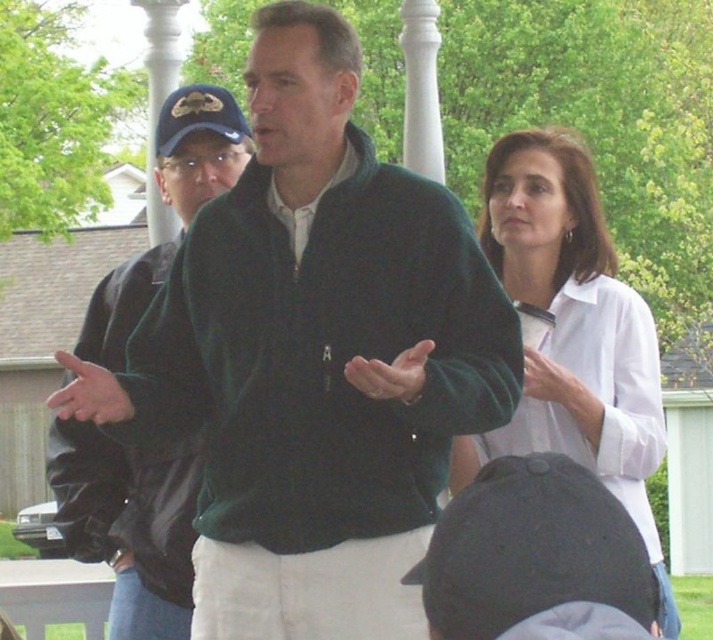
Who is taller, green fleece jacket at center or green matte jacket at left?

green fleece jacket at center is taller.

What are the coordinates of `green fleece jacket at center` in the screenshot? It's located at (314, 358).

Is point (312, 296) closer to camera compared to point (568, 221)?

Yes, it is in front of point (568, 221).

Is green fleece jacket at center to the right of white smooth blouse at upper right from the viewer's perspective?

Incorrect, green fleece jacket at center is not on the right side of white smooth blouse at upper right.

What are the coordinates of `green fleece jacket at center` in the screenshot? It's located at pyautogui.click(x=314, y=358).

The width and height of the screenshot is (713, 640). What do you see at coordinates (573, 332) in the screenshot?
I see `white smooth blouse at upper right` at bounding box center [573, 332].

Where is `white smooth blouse at upper right`? The width and height of the screenshot is (713, 640). white smooth blouse at upper right is located at coordinates (573, 332).